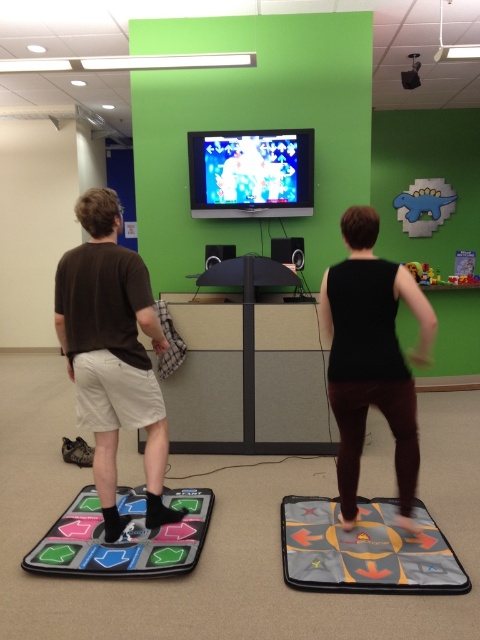
Question: Is brown cotton t-shirt at left bigger than gray rubber dance pad at lower right?

Choices:
 (A) yes
 (B) no

Answer: (A)

Question: Among these points, which one is farthest from the camera?

Choices:
 (A) (363, 554)
 (B) (147, 284)

Answer: (A)

Question: Estimate the real-world distances between objects in this image. Which object is closer to the black matte tank top at center?

Choices:
 (A) shiny plastic tv at upper center
 (B) brown cotton t-shirt at left

Answer: (B)

Question: Can you confirm if black matte tank top at center is positioned below shiny plastic tv at upper center?

Choices:
 (A) no
 (B) yes

Answer: (B)

Question: Does brown cotton t-shirt at left lie in front of black matte tank top at center?

Choices:
 (A) yes
 (B) no

Answer: (B)

Question: Which object is positioned closest to the black matte tank top at center?

Choices:
 (A) shiny plastic tv at upper center
 (B) rubberized plastic dance pad at lower left

Answer: (B)